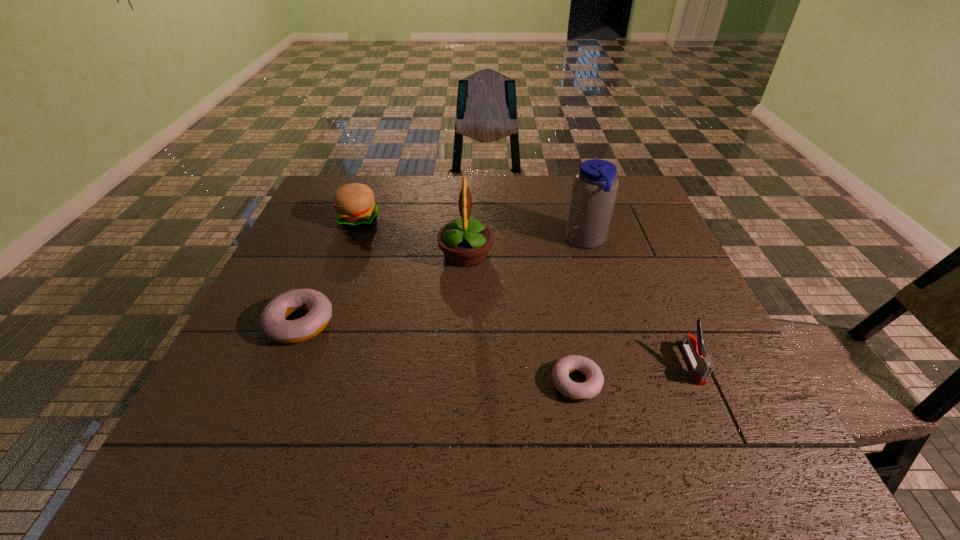
Identify which object is the second nearest to the hamburger. Please provide its 2D coordinates. Your answer should be formatted as a tuple, i.e. [(x, y)], where the tuple contains the x and y coordinates of a point satisfying the conditions above.

[(272, 320)]

Choose which object is the third nearest neighbor to the hamburger. Please provide its 2D coordinates. Your answer should be formatted as a tuple, i.e. [(x, y)], where the tuple contains the x and y coordinates of a point satisfying the conditions above.

[(595, 186)]

Locate an element on the screen. free space that satisfies the following two spatial constraints: 1. on the front side of the left doughnut; 2. on the right side of the shorter doughnut is located at coordinates [276, 383].

The width and height of the screenshot is (960, 540). In order to click on vacant point that satisfies the following two spatial constraints: 1. on the front side of the shorter doughnut; 2. on the left side of the left doughnut in this screenshot , I will do `click(276, 383)`.